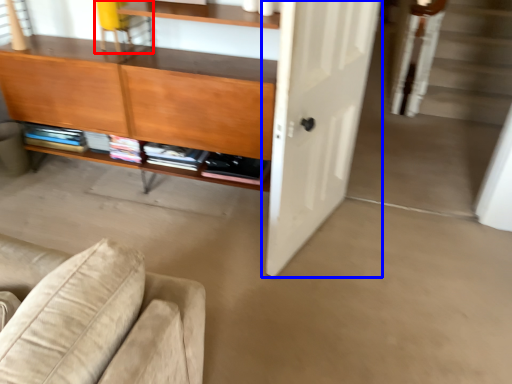
Question: Which point is further to the camera, chair (highlighted by a red box) or door (highlighted by a blue box)?

Choices:
 (A) chair
 (B) door

Answer: (A)